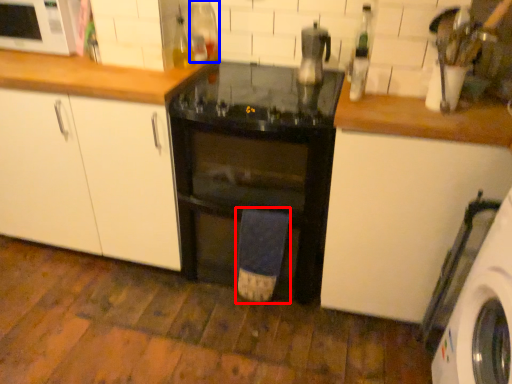
Question: Which object is further to the camera taking this photo, bath towel (highlighted by a red box) or bottle (highlighted by a blue box)?

Choices:
 (A) bath towel
 (B) bottle

Answer: (B)